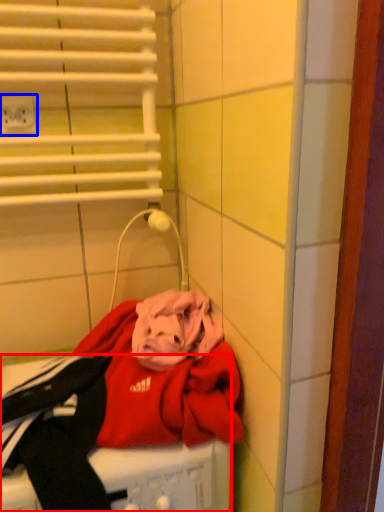
Question: Which point is closer to the camera, washing machine (highlighted by a red box) or electric outlet (highlighted by a blue box)?

Choices:
 (A) washing machine
 (B) electric outlet

Answer: (A)